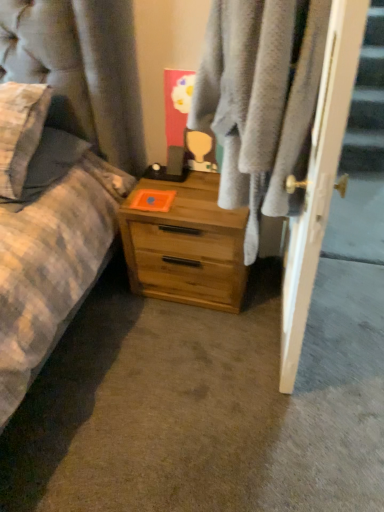
Image resolution: width=384 pixels, height=512 pixels. Identify the location of vacant region above light wood chest of drawers at center (from a real-world perspective). (177, 188).